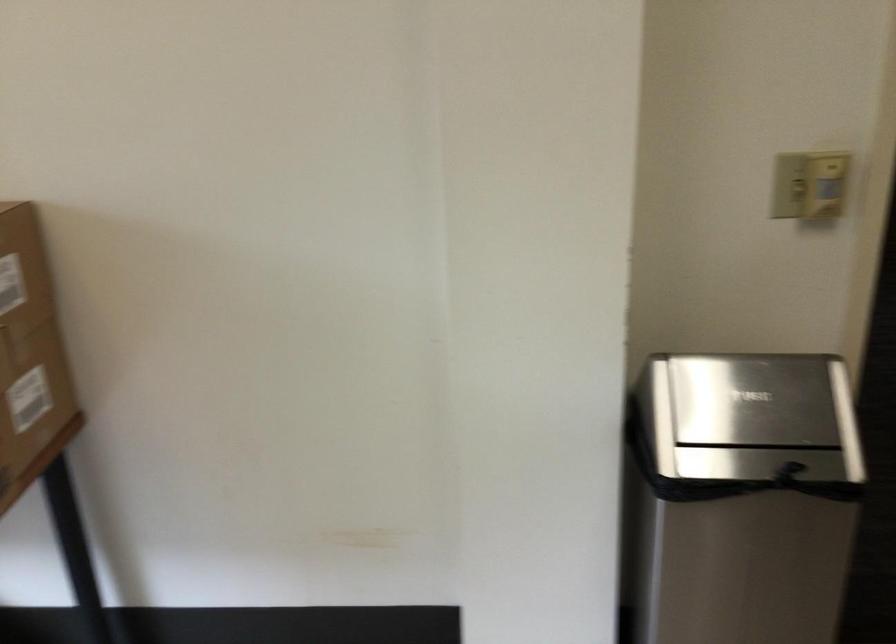
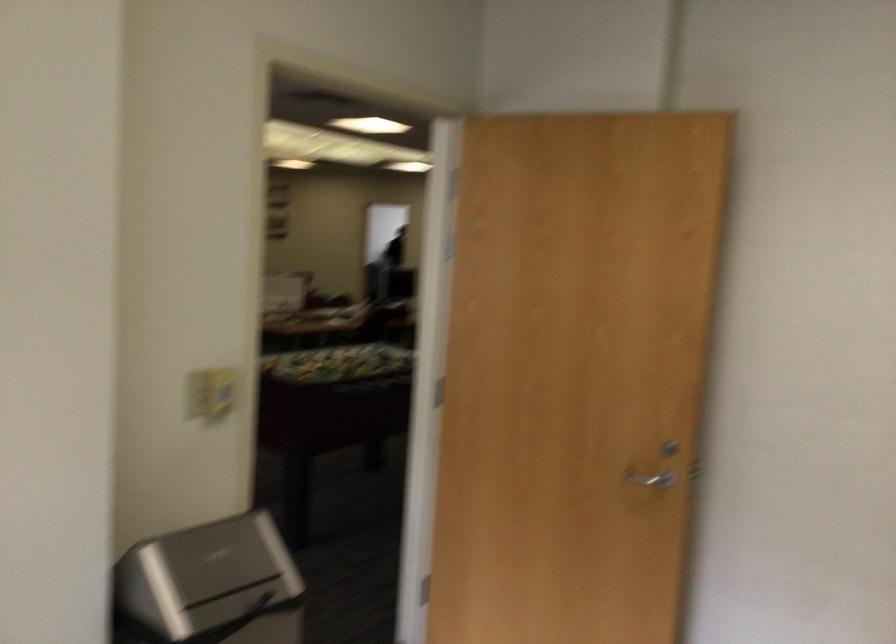
Where in the second image is the point corresponding to pixel 733 422 from the first image?

(209, 585)